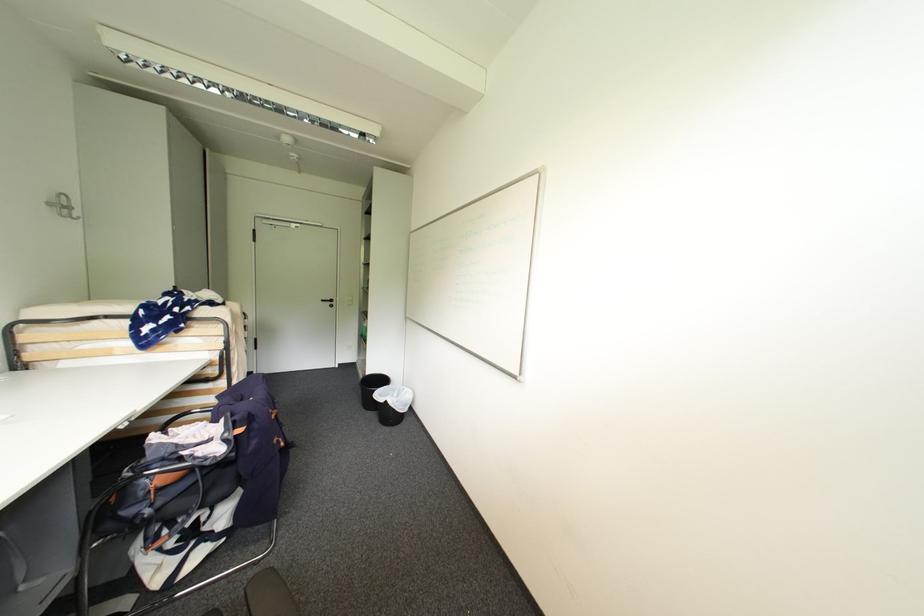
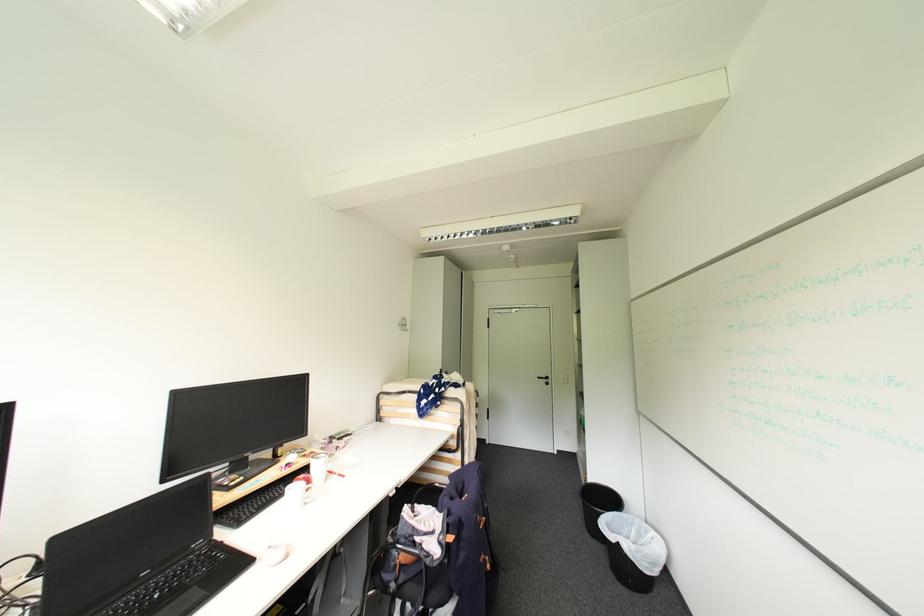
The point at (x=55, y=205) is marked in the first image. Where is the corresponding point in the second image?

(406, 325)